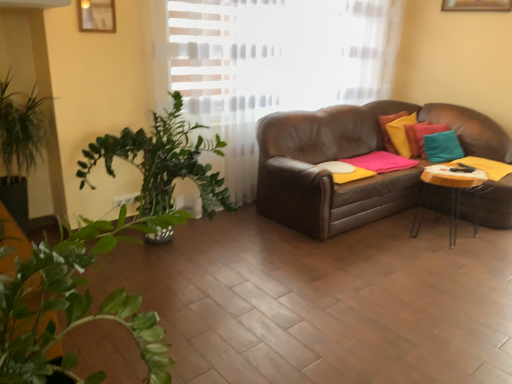
Locate an element on the screen. The height and width of the screenshot is (384, 512). wooden picture frame at upper left is located at coordinates click(97, 15).

Consider the image. What is the approximate height of wooden picture frame at upper left?

It is 14.26 inches.

Find the location of a particular element. This screenshot has width=512, height=384. yellow matte table at right is located at coordinates (451, 192).

The width and height of the screenshot is (512, 384). In order to click on teal fabric pillow at upper right in this screenshot , I will do `click(442, 147)`.

This screenshot has height=384, width=512. I want to click on wooden picture frame at upper left, so click(x=97, y=15).

Considering the sizes of objects wooden picture frame at upper left and yellow matte table at right in the image provided, who is bigger, wooden picture frame at upper left or yellow matte table at right?

With larger size is yellow matte table at right.

Is wooden picture frame at upper left next to yellow matte table at right and touching it?

No, wooden picture frame at upper left is not next to yellow matte table at right.

From a real-world perspective, which is physically above, wooden picture frame at upper left or yellow matte table at right?

wooden picture frame at upper left, from a real-world perspective.

Is wooden picture frame at upper left at the left side of yellow matte table at right?

Yes.

Which is in front, point (429, 137) or point (84, 29)?

Point (84, 29)

Considering the relative positions of teal fabric pillow at upper right and wooden picture frame at upper left in the image provided, is teal fabric pillow at upper right to the left of wooden picture frame at upper left from the viewer's perspective?

No, teal fabric pillow at upper right is not to the left of wooden picture frame at upper left.

From a real-world perspective, is teal fabric pillow at upper right located beneath wooden picture frame at upper left?

Correct, in the physical world, teal fabric pillow at upper right is lower than wooden picture frame at upper left.

Is teal fabric pillow at upper right wider than wooden picture frame at upper left?

Indeed, teal fabric pillow at upper right has a greater width compared to wooden picture frame at upper left.

Is teal fabric pillow at upper right at the back of wooden picture frame at upper left?

No, wooden picture frame at upper left is not facing the opposite direction of teal fabric pillow at upper right.

Which is behind, point (96, 25) or point (458, 144)?

The point (458, 144) is farther.

This screenshot has width=512, height=384. I want to click on picture frame to the left of teal fabric pillow at upper right, so click(x=97, y=15).

Based on the photo, does yellow matte table at right turn towards teal fabric pillow at upper right?

No, yellow matte table at right is not turned towards teal fabric pillow at upper right.

Looking at this image, from the image's perspective, which is below, yellow matte table at right or teal fabric pillow at upper right?

yellow matte table at right, from the image's perspective.

Is yellow matte table at right smaller than teal fabric pillow at upper right?

Incorrect, yellow matte table at right is not smaller in size than teal fabric pillow at upper right.

At what (x,y) coordinates should I click in order to perform the action: click on pillow on the right of yellow matte table at right. Please return your answer as a coordinate pair (x, y). Looking at the image, I should click on (442, 147).

Which is behind, point (452, 243) or point (108, 24)?

Point (452, 243)

Image resolution: width=512 pixels, height=384 pixels. I want to click on picture frame above the yellow matte table at right (from the image's perspective), so click(x=97, y=15).

What's the angular difference between yellow matte table at right and wooden picture frame at upper left's facing directions?

The angle between the facing direction of yellow matte table at right and the facing direction of wooden picture frame at upper left is 0.282 degrees.

From a real-world perspective, is teal fabric pillow at upper right over yellow matte table at right?

Yes, from a real-world perspective, teal fabric pillow at upper right is over yellow matte table at right

Does teal fabric pillow at upper right have a lesser width compared to yellow matte table at right?

Correct, the width of teal fabric pillow at upper right is less than that of yellow matte table at right.

Choose the correct answer: Is teal fabric pillow at upper right inside yellow matte table at right or outside it?

teal fabric pillow at upper right lies outside yellow matte table at right.

You are a GUI agent. You are given a task and a screenshot of the screen. Output one action in this format:
    pyautogui.click(x=<x>, y=<y>)
    Task: Click on the table lying behind the wooden picture frame at upper left
    
    Given the screenshot: What is the action you would take?
    pyautogui.click(x=451, y=192)

You are a GUI agent. You are given a task and a screenshot of the screen. Output one action in this format:
    pyautogui.click(x=<x>, y=<y>)
    Task: Click on the picture frame located in front of the teal fabric pillow at upper right
    
    Given the screenshot: What is the action you would take?
    (97, 15)

When comparing their distances from yellow matte table at right, does teal fabric pillow at upper right or wooden picture frame at upper left seem closer?

teal fabric pillow at upper right lies closer to yellow matte table at right than the other object.

When comparing their distances from teal fabric pillow at upper right, does wooden picture frame at upper left or yellow matte table at right seem closer?

The object closer to teal fabric pillow at upper right is yellow matte table at right.

Estimate the real-world distances between objects in this image. Which object is further from wooden picture frame at upper left, teal fabric pillow at upper right or yellow matte table at right?

teal fabric pillow at upper right.

Considering their positions, is yellow matte table at right positioned closer to teal fabric pillow at upper right than wooden picture frame at upper left?

Based on the image, yellow matte table at right appears to be nearer to teal fabric pillow at upper right.

Looking at the image, which one is located closer to wooden picture frame at upper left, yellow matte table at right or teal fabric pillow at upper right?

Among the two, yellow matte table at right is located nearer to wooden picture frame at upper left.

From the image, which object appears to be farther from yellow matte table at right, wooden picture frame at upper left or teal fabric pillow at upper right?

The object further to yellow matte table at right is wooden picture frame at upper left.

Image resolution: width=512 pixels, height=384 pixels. I want to click on table between wooden picture frame at upper left and teal fabric pillow at upper right in the horizontal direction, so click(451, 192).